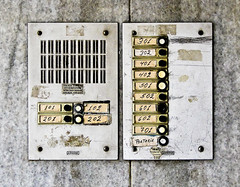
The height and width of the screenshot is (187, 240). In order to click on metal square with most buttons on it in this screenshot , I will do [x=194, y=115].